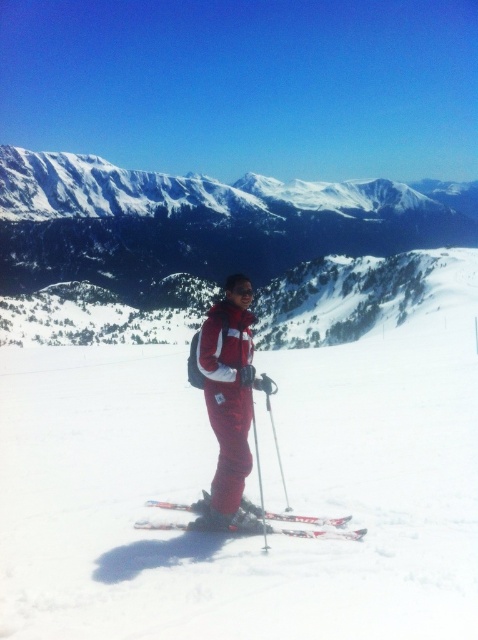
Question: Is the position of snowy mountain at center less distant than that of matte red ski suit at center?

Choices:
 (A) no
 (B) yes

Answer: (A)

Question: Does snowy mountain at center appear on the left side of matte black ski pole at center?

Choices:
 (A) yes
 (B) no

Answer: (B)

Question: Which of the following is the closest to the observer?

Choices:
 (A) white matte snow at center
 (B) snowy mountain at center

Answer: (A)

Question: Is white matte snow at center positioned at the back of matte red ski suit at center?

Choices:
 (A) no
 (B) yes

Answer: (A)

Question: Which object appears farthest from the camera in this image?

Choices:
 (A) black matte goggles at center
 (B) matte red ski suit at center
 (C) white matte snow at center
 (D) metallic skis at center

Answer: (A)

Question: Which is farther from the matte red ski suit at center?

Choices:
 (A) metallic silver ski pole at center
 (B) matte black ski pole at center

Answer: (B)